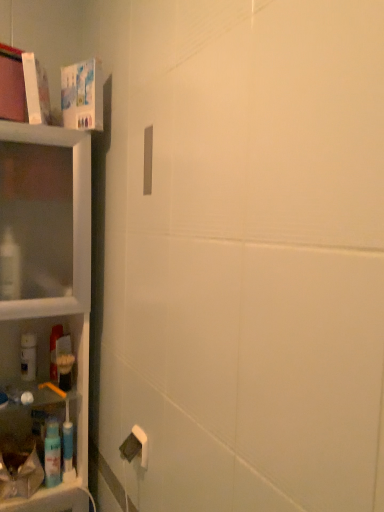
This screenshot has width=384, height=512. I want to click on blue plastic spray bottle at left, which ranks as the 2th cleaning product in top-to-bottom order, so click(x=52, y=454).

Describe the element at coordinates (54, 350) in the screenshot. I see `translucent plastic mouthwash at lower left` at that location.

I want to click on clear plastic shelf at left, so click(43, 305).

Is point (60, 327) in front of point (29, 244)?

No, it is behind (29, 244).

Considering the sizes of objects translucent plastic mouthwash at lower left and clear plastic shelf at left in the image provided, who is bigger, translucent plastic mouthwash at lower left or clear plastic shelf at left?

Bigger between the two is clear plastic shelf at left.

Who is shorter, translucent plastic mouthwash at lower left or clear plastic shelf at left?

translucent plastic mouthwash at lower left is shorter.

Which object is further away from the camera taking this photo, blue plastic spray bottle at left, which appears as the first cleaning product when viewed from the right, or clear plastic shelf at left?

blue plastic spray bottle at left, which appears as the first cleaning product when viewed from the right.

Between blue plastic spray bottle at left, which is the 1th cleaning product from bottom to top, and clear plastic shelf at left, which one appears on the right side from the viewer's perspective?

blue plastic spray bottle at left, which is the 1th cleaning product from bottom to top.

In the scene shown: Between blue plastic spray bottle at left, which appears as the first cleaning product when viewed from the right, and white matte bottle at left, which is counted as the 1th cleaning product, starting from the back, which one appears on the left side from the viewer's perspective?

white matte bottle at left, which is counted as the 1th cleaning product, starting from the back.

Is blue plastic spray bottle at left, which ranks as the second cleaning product in back-to-front order, not near white matte bottle at left, placed as the first cleaning product when sorted from top to bottom?

blue plastic spray bottle at left, which ranks as the second cleaning product in back-to-front order, is near white matte bottle at left, placed as the first cleaning product when sorted from top to bottom, not far away.

In terms of size, does blue plastic spray bottle at left, which is the 1th cleaning product from bottom to top, appear bigger or smaller than white matte bottle at left, which is counted as the 1th cleaning product, starting from the back?

blue plastic spray bottle at left, which is the 1th cleaning product from bottom to top, is smaller than white matte bottle at left, which is counted as the 1th cleaning product, starting from the back.

Is blue plastic spray bottle at left, placed as the second cleaning product when sorted from left to right, positioned in front of white matte bottle at left, placed as the first cleaning product when sorted from top to bottom?

Yes.

Does clear plastic shelf at left have a greater width compared to white matte bottle at left, which is the second cleaning product from bottom to top?

Yes.

Considering the relative positions of clear plastic shelf at left and white matte bottle at left, which is the second cleaning product from bottom to top, in the image provided, is clear plastic shelf at left to the left or to the right of white matte bottle at left, which is the second cleaning product from bottom to top,?

From the image, it's evident that clear plastic shelf at left is to the right of white matte bottle at left, which is the second cleaning product from bottom to top.

Relative to white matte bottle at left, placed as the first cleaning product when sorted from top to bottom, is clear plastic shelf at left in front or behind?

clear plastic shelf at left is positioned closer to the viewer than white matte bottle at left, placed as the first cleaning product when sorted from top to bottom.

Between clear plastic shelf at left and white matte bottle at left, placed as the second cleaning product when sorted from front to back, which one has less height?

white matte bottle at left, placed as the second cleaning product when sorted from front to back.

What's the angular difference between clear plastic shelf at left and blue plastic spray bottle at left, which ranks as the second cleaning product in back-to-front order,'s facing directions?

clear plastic shelf at left and blue plastic spray bottle at left, which ranks as the second cleaning product in back-to-front order, are facing 0.204 degrees away from each other.

From the picture: Does clear plastic shelf at left lie in front of blue plastic spray bottle at left, which is counted as the first cleaning product, starting from the front?

Yes, clear plastic shelf at left is in front of blue plastic spray bottle at left, which is counted as the first cleaning product, starting from the front.

Consider the image. Is blue plastic spray bottle at left, which is counted as the first cleaning product, starting from the front, completely or partially inside clear plastic shelf at left?

Yes, blue plastic spray bottle at left, which is counted as the first cleaning product, starting from the front, can be found within clear plastic shelf at left.

Is clear plastic shelf at left facing away from blue plastic spray bottle at left, which is the 1th cleaning product from bottom to top?

That's right, clear plastic shelf at left is facing away from blue plastic spray bottle at left, which is the 1th cleaning product from bottom to top.

Is there a large distance between clear plastic shelf at left and translucent plastic mouthwash at lower left?

No, there isn't a large distance between clear plastic shelf at left and translucent plastic mouthwash at lower left.

Based on the photo, what's the angular difference between clear plastic shelf at left and translucent plastic mouthwash at lower left's facing directions?

They differ by 0.205 degrees in their facing directions.

Considering the relative sizes of clear plastic shelf at left and translucent plastic mouthwash at lower left in the image provided, is clear plastic shelf at left shorter than translucent plastic mouthwash at lower left?

No.

Can we say clear plastic shelf at left lies outside translucent plastic mouthwash at lower left?

Yes, clear plastic shelf at left is outside of translucent plastic mouthwash at lower left.

Which object is wider, translucent plastic mouthwash at lower left or blue plastic spray bottle at left, which appears as the first cleaning product when viewed from the right?

Wider between the two is translucent plastic mouthwash at lower left.

Based on the photo, which point is more distant from viewer, (55,328) or (52,447)?

The point (55,328) is more distant.

Is translucent plastic mouthwash at lower left oriented towards blue plastic spray bottle at left, which is the 1th cleaning product from bottom to top?

No, translucent plastic mouthwash at lower left is not facing towards blue plastic spray bottle at left, which is the 1th cleaning product from bottom to top.

Is translucent plastic mouthwash at lower left in front of or behind blue plastic spray bottle at left, which is counted as the first cleaning product, starting from the front, in the image?

translucent plastic mouthwash at lower left is positioned farther from the viewer than blue plastic spray bottle at left, which is counted as the first cleaning product, starting from the front.

The width and height of the screenshot is (384, 512). Identify the location of shelf lying in front of the translucent plastic mouthwash at lower left. (43, 305).

There is a clear plastic shelf at left. Where is `the 2nd cleaning product below it (from the image's perspective)`? This screenshot has height=512, width=384. the 2nd cleaning product below it (from the image's perspective) is located at coordinates (52, 454).

Considering their positions, is translucent plastic mouthwash at lower left positioned further to blue plastic spray bottle at left, which appears as the first cleaning product when viewed from the right, than clear plastic shelf at left?

clear plastic shelf at left is positioned further to the anchor blue plastic spray bottle at left, which appears as the first cleaning product when viewed from the right.

Considering their positions, is blue plastic spray bottle at left, which ranks as the second cleaning product in back-to-front order, positioned closer to translucent plastic mouthwash at lower left than white matte bottle at left, the second cleaning product positioned from the right?

white matte bottle at left, the second cleaning product positioned from the right, is positioned closer to the anchor translucent plastic mouthwash at lower left.

From the picture: Based on their spatial positions, is blue plastic spray bottle at left, placed as the second cleaning product when sorted from left to right, or white matte bottle at left, the second cleaning product positioned from the right, further from clear plastic shelf at left?

blue plastic spray bottle at left, placed as the second cleaning product when sorted from left to right, is further to clear plastic shelf at left.

Estimate the real-world distances between objects in this image. Which object is further from white matte bottle at left, placed as the second cleaning product when sorted from front to back, translucent plastic mouthwash at lower left or clear plastic shelf at left?

Among the two, clear plastic shelf at left is located further to white matte bottle at left, placed as the second cleaning product when sorted from front to back.

Which object lies nearer to the anchor point clear plastic shelf at left, white matte bottle at left, placed as the first cleaning product when sorted from top to bottom, or translucent plastic mouthwash at lower left?

Based on the image, translucent plastic mouthwash at lower left appears to be nearer to clear plastic shelf at left.

Based on their spatial positions, is translucent plastic mouthwash at lower left or blue plastic spray bottle at left, which is the 1th cleaning product from bottom to top, closer to clear plastic shelf at left?

translucent plastic mouthwash at lower left is positioned closer to the anchor clear plastic shelf at left.

When comparing their distances from clear plastic shelf at left, does blue plastic spray bottle at left, which is the 1th cleaning product from bottom to top, or translucent plastic mouthwash at lower left seem further?

The object further to clear plastic shelf at left is blue plastic spray bottle at left, which is the 1th cleaning product from bottom to top.

When comparing their distances from blue plastic spray bottle at left, which ranks as the second cleaning product in back-to-front order, does white matte bottle at left, which is the second cleaning product from bottom to top, or translucent plastic mouthwash at lower left seem closer?

translucent plastic mouthwash at lower left lies closer to blue plastic spray bottle at left, which ranks as the second cleaning product in back-to-front order, than the other object.

The height and width of the screenshot is (512, 384). I want to click on mouthwash that lies between clear plastic shelf at left and blue plastic spray bottle at left, which appears as the first cleaning product when viewed from the right, from top to bottom, so click(54, 350).

Identify the location of cleaning product between translucent plastic mouthwash at lower left and blue plastic spray bottle at left, placed as the second cleaning product when sorted from left to right, vertically. The width and height of the screenshot is (384, 512). (28, 356).

I want to click on cleaning product that lies between clear plastic shelf at left and blue plastic spray bottle at left, which appears as the first cleaning product when viewed from the right, from top to bottom, so pyautogui.click(x=28, y=356).